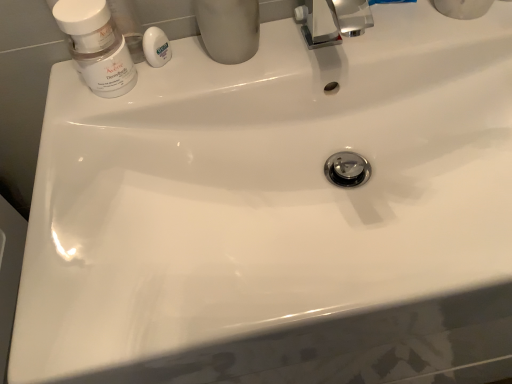
Question: Should I look upward or downward to see matte gray cup at upper center?

Choices:
 (A) up
 (B) down

Answer: (A)

Question: From a real-world perspective, does matte white jar at upper left sit lower than matte gray cup at upper center?

Choices:
 (A) no
 (B) yes

Answer: (B)

Question: Does matte white jar at upper left have a greater width compared to matte gray cup at upper center?

Choices:
 (A) no
 (B) yes

Answer: (A)

Question: Does matte white jar at upper left appear on the left side of matte gray cup at upper center?

Choices:
 (A) no
 (B) yes

Answer: (B)

Question: Can you confirm if matte white jar at upper left is smaller than matte gray cup at upper center?

Choices:
 (A) yes
 (B) no

Answer: (A)

Question: Considering the relative sizes of matte white jar at upper left and matte gray cup at upper center in the image provided, is matte white jar at upper left taller than matte gray cup at upper center?

Choices:
 (A) yes
 (B) no

Answer: (B)

Question: Is matte white jar at upper left in front of matte gray cup at upper center?

Choices:
 (A) no
 (B) yes

Answer: (A)

Question: From the image's perspective, is matte gray cup at upper center below matte white jar at upper left?

Choices:
 (A) no
 (B) yes

Answer: (A)

Question: Is matte gray cup at upper center taller than matte white jar at upper left?

Choices:
 (A) yes
 (B) no

Answer: (A)

Question: Considering the relative positions of matte gray cup at upper center and matte white jar at upper left in the image provided, is matte gray cup at upper center to the left of matte white jar at upper left from the viewer's perspective?

Choices:
 (A) no
 (B) yes

Answer: (A)

Question: Is matte white jar at upper left surrounded by matte gray cup at upper center?

Choices:
 (A) no
 (B) yes

Answer: (A)

Question: Does matte gray cup at upper center have a smaller size compared to matte white jar at upper left?

Choices:
 (A) yes
 (B) no

Answer: (B)

Question: Does matte gray cup at upper center lie behind matte white jar at upper left?

Choices:
 (A) no
 (B) yes

Answer: (A)

Question: Does white glossy soap at upper center have a greater width compared to matte white jar at upper left?

Choices:
 (A) no
 (B) yes

Answer: (A)